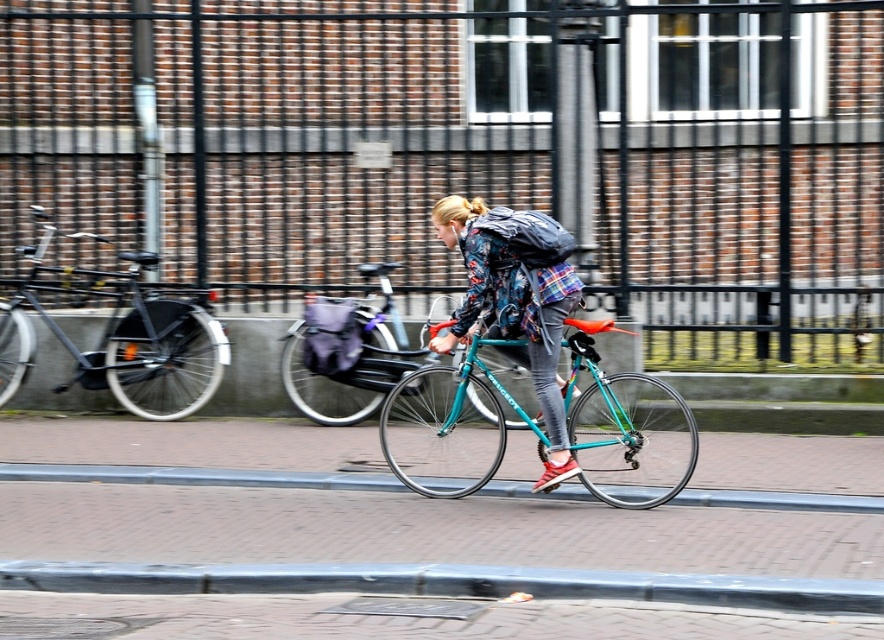
Question: Can you confirm if smooth concrete curb at lower center is wider than teal glossy bicycle at center?

Choices:
 (A) yes
 (B) no

Answer: (A)

Question: Which point is closer to the camera?

Choices:
 (A) matte black bicycle at left
 (B) teal metallic bicycle at center
 (C) brick pavement at center

Answer: (C)

Question: Does teal metallic bicycle at center appear under brick at lower center?

Choices:
 (A) yes
 (B) no

Answer: (B)

Question: Does teal metallic bicycle at center have a lesser width compared to teal glossy bicycle at center?

Choices:
 (A) yes
 (B) no

Answer: (B)

Question: Which object is the closest to the matte black bicycle at left?

Choices:
 (A) teal metallic bicycle at center
 (B) brick at lower center

Answer: (B)

Question: Which point appears closest to the camera in this image?

Choices:
 (A) (471, 234)
 (B) (509, 474)
 (C) (63, 236)

Answer: (A)